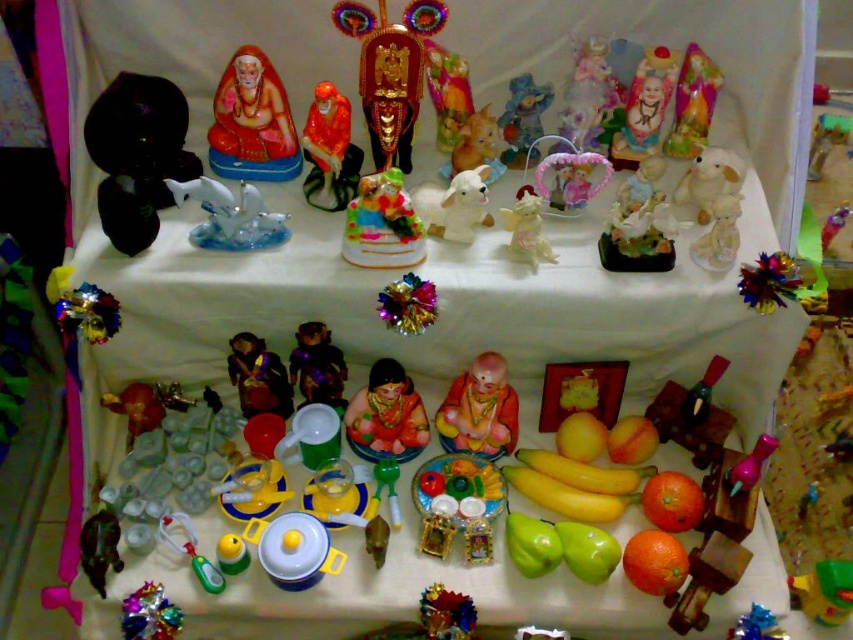
Question: Does white glossy figurine at center have a smaller size compared to shiny metallic figurine at center?

Choices:
 (A) yes
 (B) no

Answer: (A)

Question: Which object is positioned farthest from the orange matte at lower right?

Choices:
 (A) white plush rabbit at center
 (B) metallic silver toy at upper right
 (C) matte plastic cake at center

Answer: (B)

Question: Which point is closer to the camera taking this photo?

Choices:
 (A) (752, 458)
 (B) (115, 164)
 (C) (135, 602)

Answer: (C)

Question: Which object is closer to the camera taking this photo?

Choices:
 (A) matte orange statue at center
 (B) matte ceramic statue at upper center

Answer: (A)

Question: Considering the relative positions of white plush dog at upper right and white plush rabbit at center in the image provided, where is white plush dog at upper right located with respect to white plush rabbit at center?

Choices:
 (A) left
 (B) right

Answer: (B)

Question: Does matte plastic cake at center appear on the left side of orange glossy statue at center?

Choices:
 (A) yes
 (B) no

Answer: (B)